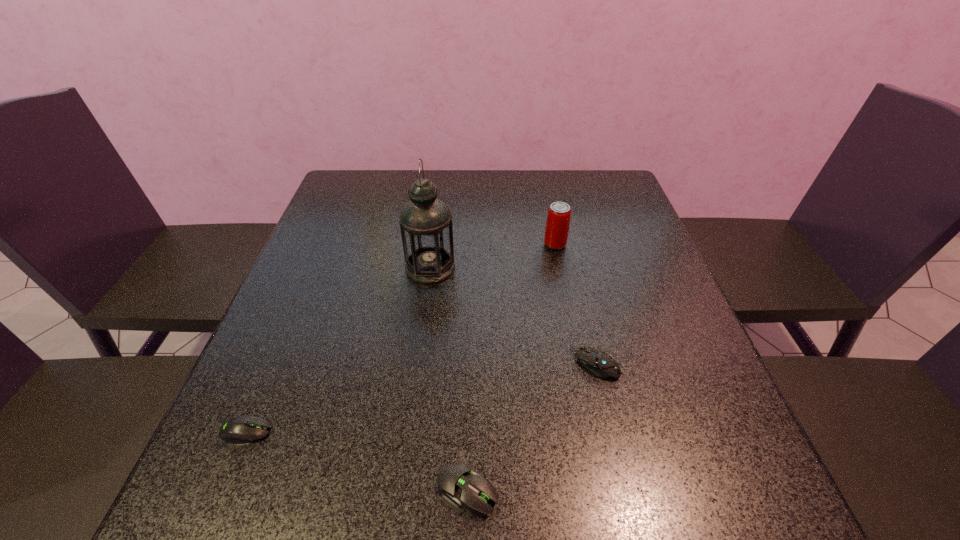
You are a GUI agent. You are given a task and a screenshot of the screen. Output one action in this format:
    pyautogui.click(x=<x>, y=<y>)
    Task: Click on the vacant space at the right edge
    This screenshot has width=960, height=540.
    Given the screenshot: What is the action you would take?
    pyautogui.click(x=660, y=437)

In order to click on free location at the far right corner of the desktop in this screenshot , I will do `click(597, 197)`.

This screenshot has height=540, width=960. I want to click on vacant region between the second nearest computer mouse and the third nearest object, so click(420, 397).

Find the location of a particular element. empty location between the second tallest object and the rightmost computer mouse is located at coordinates (575, 304).

Image resolution: width=960 pixels, height=540 pixels. Identify the location of empty space that is in between the leftmost computer mouse and the second tallest object. (400, 338).

Identify the location of vacant space that's between the beer can and the nearest computer mouse. This screenshot has height=540, width=960. (512, 367).

In order to click on vacant area that lies between the second computer mouse from right to left and the oil lamp in this screenshot , I will do `click(449, 379)`.

This screenshot has width=960, height=540. I want to click on empty space that is in between the nearest computer mouse and the fourth farthest object, so click(357, 461).

I want to click on free spot between the nearest computer mouse and the oil lamp, so click(x=449, y=379).

Find the location of `vacant area that lies between the rightmost computer mouse and the tallest object`. vacant area that lies between the rightmost computer mouse and the tallest object is located at coordinates (513, 315).